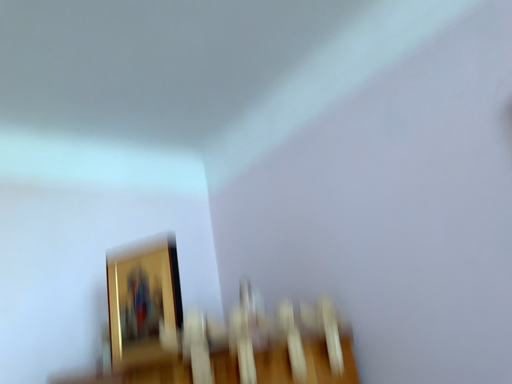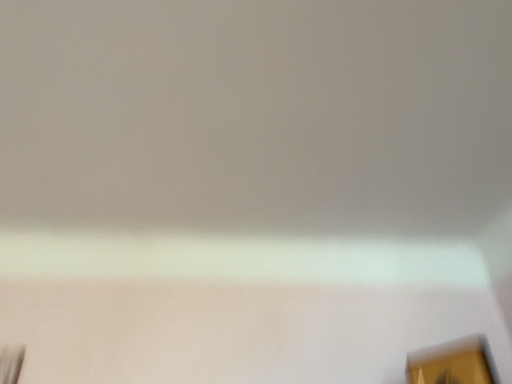
Question: Which way did the camera rotate in the video?

Choices:
 (A) rotated left
 (B) rotated right

Answer: (A)